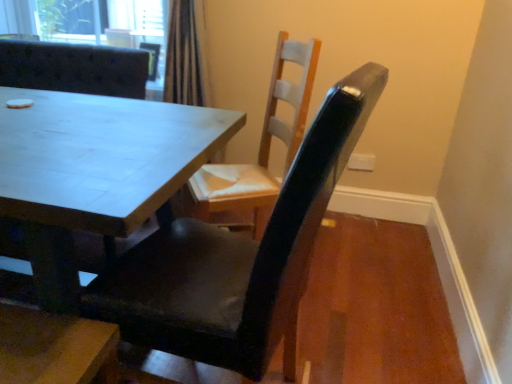
This screenshot has width=512, height=384. What do you see at coordinates (74, 68) in the screenshot? I see `matte black chair at center, marked as the first chair in a left-to-right arrangement` at bounding box center [74, 68].

At what (x,y) coordinates should I click in order to perform the action: click on matte black chair at center, which is counted as the second chair, starting from the right. Please return your answer as a coordinate pair (x, y). This screenshot has width=512, height=384. Looking at the image, I should click on (237, 257).

Locate an element on the screen. white wood chair at center, which appears as the third chair when viewed from the left is located at coordinates (261, 144).

Which is closer to the camera, [214,192] or [34,55]?

Positioned in front is point [214,192].

Is white wood chair at center, which appears as the third chair when viewed from the left, positioned far away from matte black chair at center, positioned as the third chair in right-to-left order?

white wood chair at center, which appears as the third chair when viewed from the left, is near matte black chair at center, positioned as the third chair in right-to-left order, not far away.

From a real-world perspective, does white wood chair at center, which ranks as the 1th chair in right-to-left order, sit lower than matte black chair at center, positioned as the third chair in right-to-left order?

No, from a real-world perspective, white wood chair at center, which ranks as the 1th chair in right-to-left order, is not below matte black chair at center, positioned as the third chair in right-to-left order.

From the matte black chair at center, positioned as the third chair in right-to-left order, count 1st chairs forward and point to it. Please provide its 2D coordinates.

[(261, 144)]

From a real-world perspective, who is located higher, matte black chair at center, marked as the first chair in a left-to-right arrangement, or white wood chair at center, which appears as the third chair when viewed from the left?

From a 3D spatial view, white wood chair at center, which appears as the third chair when viewed from the left, is above.

Can you confirm if matte black chair at center, marked as the first chair in a left-to-right arrangement, is bigger than white wood chair at center, which ranks as the 1th chair in right-to-left order?

Correct, matte black chair at center, marked as the first chair in a left-to-right arrangement, is larger in size than white wood chair at center, which ranks as the 1th chair in right-to-left order.

How far apart are matte black chair at center, positioned as the third chair in right-to-left order, and white wood chair at center, which ranks as the 1th chair in right-to-left order?

matte black chair at center, positioned as the third chair in right-to-left order, and white wood chair at center, which ranks as the 1th chair in right-to-left order, are 81.79 centimeters apart.

Is point (31, 78) less distant than point (207, 167)?

No, (31, 78) is further to viewer.

Is matte black chair at center, the 2th chair when ordered from left to right, not within white wood chair at center, which ranks as the 1th chair in right-to-left order?

Yes, matte black chair at center, the 2th chair when ordered from left to right, is located beyond the bounds of white wood chair at center, which ranks as the 1th chair in right-to-left order.

What's the angular difference between matte black chair at center, which is counted as the second chair, starting from the right, and white wood chair at center, which ranks as the 1th chair in right-to-left order,'s facing directions?

They differ by 37.1 degrees in their facing directions.

Identify the location of chair in front of the white wood chair at center, which appears as the third chair when viewed from the left. (237, 257).

Does white wood chair at center, which appears as the third chair when viewed from the left, lie behind matte black chair at center, which is counted as the second chair, starting from the right?

Yes, it is.

Is white wood chair at center, which ranks as the 1th chair in right-to-left order, to the right of matte black chair at center, the 2th chair when ordered from left to right, from the viewer's perspective?

Correct, you'll find white wood chair at center, which ranks as the 1th chair in right-to-left order, to the right of matte black chair at center, the 2th chair when ordered from left to right.

Considering the positions of point (217, 168) and point (284, 275), is point (217, 168) closer or farther from the camera than point (284, 275)?

Point (217, 168) is positioned farther from the camera compared to point (284, 275).

From a real-world perspective, who is located lower, matte black chair at center, which is counted as the second chair, starting from the right, or matte black chair at center, positioned as the third chair in right-to-left order?

matte black chair at center, positioned as the third chair in right-to-left order.

Is matte black chair at center, which is counted as the second chair, starting from the right, far away from matte black chair at center, positioned as the third chair in right-to-left order?

matte black chair at center, which is counted as the second chair, starting from the right, is positioned a significant distance from matte black chair at center, positioned as the third chair in right-to-left order.

Is matte black chair at center, the 2th chair when ordered from left to right, taller than matte black chair at center, positioned as the third chair in right-to-left order?

Yes.

Which point is more forward, (x=244, y=316) or (x=80, y=88)?

The point (x=244, y=316) is closer.

Could you measure the distance between matte black chair at center, marked as the first chair in a left-to-right arrangement, and matte black chair at center, the 2th chair when ordered from left to right?

They are 4.72 feet apart.

From a real-world perspective, starting from the matte black chair at center, positioned as the third chair in right-to-left order, which chair is the 1st one vertically above it? Please provide its 2D coordinates.

[(237, 257)]

Is matte black chair at center, marked as the first chair in a left-to-right arrangement, not inside matte black chair at center, the 2th chair when ordered from left to right?

matte black chair at center, marked as the first chair in a left-to-right arrangement, is positioned outside matte black chair at center, the 2th chair when ordered from left to right.

Is matte black chair at center, marked as the first chair in a left-to-right arrangement, far away from matte black chair at center, the 2th chair when ordered from left to right?

Indeed, matte black chair at center, marked as the first chair in a left-to-right arrangement, is not near matte black chair at center, the 2th chair when ordered from left to right.

The height and width of the screenshot is (384, 512). What are the coordinates of `the 2nd chair located beneath the white wood chair at center, which appears as the third chair when viewed from the left (from a real-world perspective)` in the screenshot? It's located at (74, 68).

There is a matte black chair at center, marked as the first chair in a left-to-right arrangement. Where is `the 2nd chair above it (from a real-world perspective)`? This screenshot has width=512, height=384. the 2nd chair above it (from a real-world perspective) is located at coordinates (261, 144).

From the image, which object appears to be farther from white wood chair at center, which ranks as the 1th chair in right-to-left order, matte black chair at center, positioned as the third chair in right-to-left order, or matte black chair at center, the 2th chair when ordered from left to right?

Based on the image, matte black chair at center, positioned as the third chair in right-to-left order, appears to be further to white wood chair at center, which ranks as the 1th chair in right-to-left order.

From the image, which object appears to be farther from matte black chair at center, marked as the first chair in a left-to-right arrangement, matte black chair at center, the 2th chair when ordered from left to right, or white wood chair at center, which ranks as the 1th chair in right-to-left order?

The object further to matte black chair at center, marked as the first chair in a left-to-right arrangement, is matte black chair at center, the 2th chair when ordered from left to right.

From the image, which object appears to be farther from matte black chair at center, the 2th chair when ordered from left to right, matte black chair at center, positioned as the third chair in right-to-left order, or white wood chair at center, which appears as the third chair when viewed from the left?

matte black chair at center, positioned as the third chair in right-to-left order, is further to matte black chair at center, the 2th chair when ordered from left to right.

Which object lies nearer to the anchor point matte black chair at center, the 2th chair when ordered from left to right, white wood chair at center, which appears as the third chair when viewed from the left, or matte black chair at center, positioned as the third chair in right-to-left order?

white wood chair at center, which appears as the third chair when viewed from the left, is closer to matte black chair at center, the 2th chair when ordered from left to right.

Which object lies further to the anchor point matte black chair at center, positioned as the third chair in right-to-left order, white wood chair at center, which ranks as the 1th chair in right-to-left order, or matte black chair at center, which is counted as the second chair, starting from the right?

Among the two, matte black chair at center, which is counted as the second chair, starting from the right, is located further to matte black chair at center, positioned as the third chair in right-to-left order.

Which object lies nearer to the anchor point white wood chair at center, which ranks as the 1th chair in right-to-left order, matte black chair at center, the 2th chair when ordered from left to right, or matte black chair at center, positioned as the third chair in right-to-left order?

Based on the image, matte black chair at center, the 2th chair when ordered from left to right, appears to be nearer to white wood chair at center, which ranks as the 1th chair in right-to-left order.

At what (x,y) coordinates should I click in order to perform the action: click on chair between matte black chair at center, positioned as the third chair in right-to-left order, and white wood chair at center, which ranks as the 1th chair in right-to-left order. Please return your answer as a coordinate pair (x, y). The height and width of the screenshot is (384, 512). Looking at the image, I should click on (237, 257).